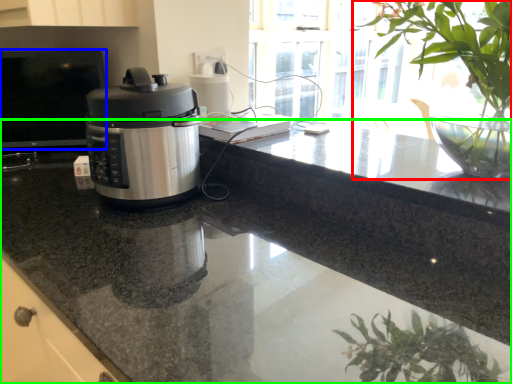
Question: Considering the real-world distances, which object is closest to houseplant (highlighted by a red box)? desktop (highlighted by a blue box) or countertop (highlighted by a green box).

Choices:
 (A) desktop
 (B) countertop

Answer: (B)